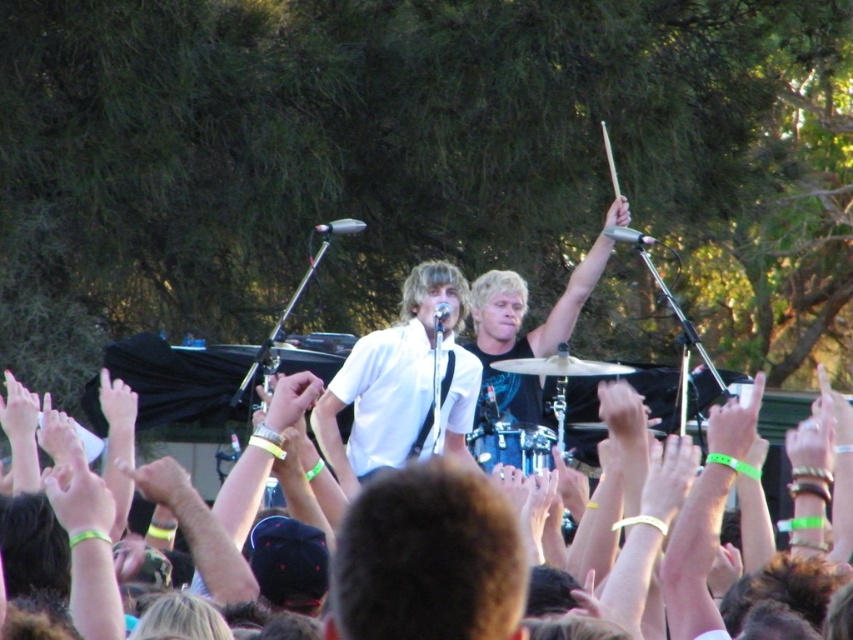
Which is above, white matte hand at center or pink rubber band at upper right?

white matte hand at center

Which is behind, point (302, 381) or point (837, 438)?

Positioned behind is point (302, 381).

This screenshot has height=640, width=853. In order to click on white matte hand at center in this screenshot , I will do `click(291, 400)`.

Is smooth skin hand at center wider than white matte hand at upper center?

Yes, smooth skin hand at center is wider than white matte hand at upper center.

Identify the location of smooth skin hand at center. click(668, 477).

In the scene shown: Does green matte hand at upper center appear on the left side of white matte hand at upper center?

Indeed, green matte hand at upper center is positioned on the left side of white matte hand at upper center.

Does point (120, 390) come farther from viewer compared to point (627, 216)?

That is False.

Find the location of `green matte hand at upper center`. green matte hand at upper center is located at coordinates (115, 403).